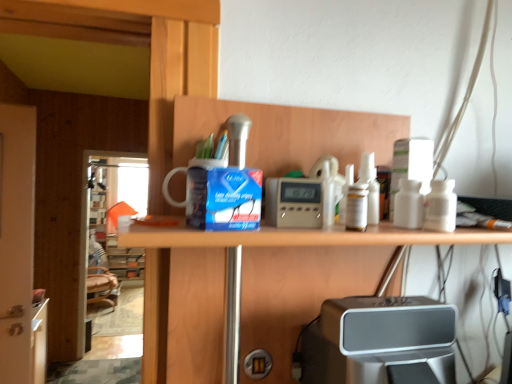
Question: Considering the relative sizes of transparent glass screen door at left, arranged as the first screen door when viewed from the left, and silver metallic speaker at lower center in the image provided, is transparent glass screen door at left, arranged as the first screen door when viewed from the left, bigger than silver metallic speaker at lower center?

Choices:
 (A) yes
 (B) no

Answer: (A)

Question: Is silver metallic speaker at lower center surrounded by transparent glass screen door at left, the 2th screen door from the right?

Choices:
 (A) yes
 (B) no

Answer: (B)

Question: From a real-world perspective, is transparent glass screen door at left, the first screen door from the back, located beneath silver metallic speaker at lower center?

Choices:
 (A) yes
 (B) no

Answer: (A)

Question: Is transparent glass screen door at left, marked as the second screen door in a front-to-back arrangement, at the right side of silver metallic speaker at lower center?

Choices:
 (A) no
 (B) yes

Answer: (A)

Question: Considering the relative sizes of transparent glass screen door at left, marked as the second screen door in a front-to-back arrangement, and silver metallic speaker at lower center in the image provided, is transparent glass screen door at left, marked as the second screen door in a front-to-back arrangement, thinner than silver metallic speaker at lower center?

Choices:
 (A) no
 (B) yes

Answer: (B)

Question: Looking at the image, does silver metallic speaker at lower center seem bigger or smaller compared to matte digital clock at center?

Choices:
 (A) big
 (B) small

Answer: (A)

Question: Would you say silver metallic speaker at lower center is to the left or to the right of matte digital clock at center in the picture?

Choices:
 (A) left
 (B) right

Answer: (B)

Question: Is silver metallic speaker at lower center wider or thinner than matte digital clock at center?

Choices:
 (A) wide
 (B) thin

Answer: (A)

Question: From a real-world perspective, relative to matte digital clock at center, is silver metallic speaker at lower center vertically above or below?

Choices:
 (A) above
 (B) below

Answer: (B)

Question: From the image's perspective, is white glossy door at left, the 2th screen door positioned from the back, above or below matte digital clock at center?

Choices:
 (A) below
 (B) above

Answer: (A)

Question: Is white glossy door at left, the 2th screen door positioned from the back, inside the boundaries of matte digital clock at center, or outside?

Choices:
 (A) inside
 (B) outside

Answer: (B)

Question: Does point (9, 352) appear closer or farther from the camera than point (297, 196)?

Choices:
 (A) closer
 (B) farther

Answer: (B)

Question: In terms of width, does white glossy door at left, which ranks as the second screen door in left-to-right order, look wider or thinner when compared to matte digital clock at center?

Choices:
 (A) thin
 (B) wide

Answer: (B)

Question: Considering the positions of transparent glass screen door at left, the first screen door from the back, and matte digital clock at center in the image, is transparent glass screen door at left, the first screen door from the back, wider or thinner than matte digital clock at center?

Choices:
 (A) wide
 (B) thin

Answer: (A)

Question: Does point (86, 178) appear closer or farther from the camera than point (284, 203)?

Choices:
 (A) closer
 (B) farther

Answer: (B)